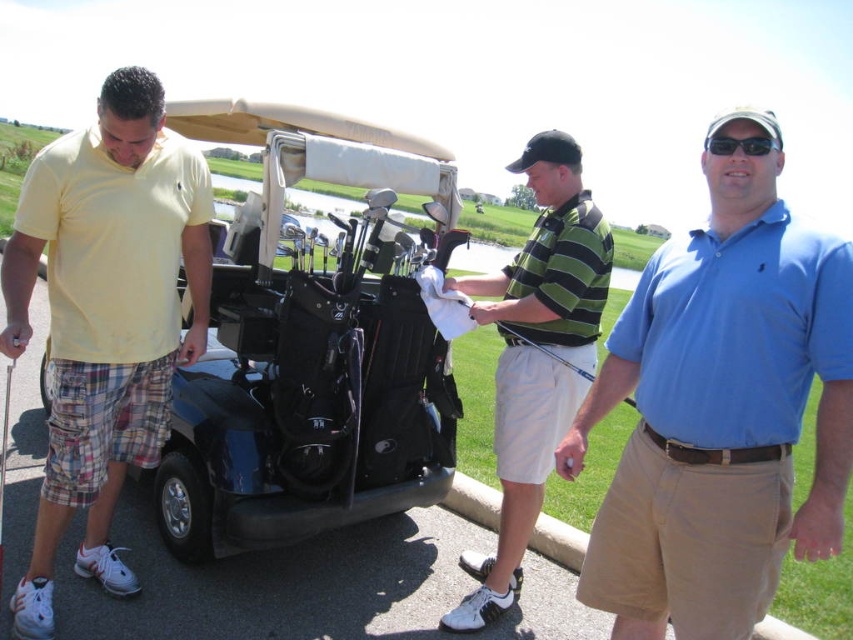
You are a golfer standing at the center of the image. You need to locate the black matte golf cart at left. According to the coordinates provided, in which direction should you look to find it?

The black matte golf cart at left is located at coordinates point [312,344]. Since you are at the center, looking to the left side of the image will help you find it.